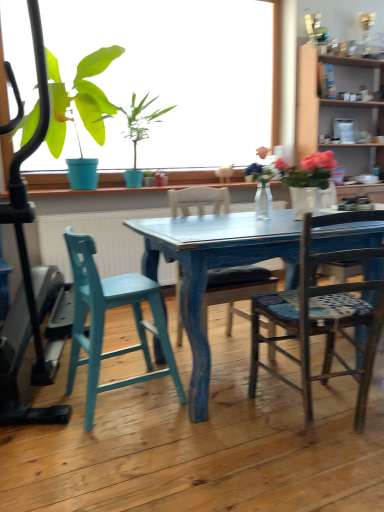
Measure the distance between point (347, 143) and camera.

A distance of 3.84 meters exists between point (347, 143) and camera.

This screenshot has width=384, height=512. Identify the location of matte white mug at upper center. (346, 131).

How much space does wooden chair with patterned seat cushion at center, which appears as the third chair when viewed from the left, occupy vertically?

35.22 inches.

What do you see at coordinates (323, 317) in the screenshot?
I see `wooden chair with patterned seat cushion at center, the 1th chair when ordered from right to left` at bounding box center [323, 317].

You are a GUI agent. You are given a task and a screenshot of the screen. Output one action in this format:
    pyautogui.click(x=<x>, y=<y>)
    Task: Click on the wooden chair at center, which appears as the second chair when viewed from the left
    The height and width of the screenshot is (512, 384).
    Given the screenshot: What is the action you would take?
    pyautogui.click(x=235, y=289)

In order to face wooden chair at center, which appears as the second chair when viewed from the left, should I rotate leftwards or rightwards?

It's best to rotate right around 3.713 degrees.

I want to click on green matte plant at upper left, so click(x=79, y=97).

From the image's perspective, is green matte plant at upper left beneath teal wood stool at left, which appears as the 3th chair when viewed from the right?

Incorrect, from the image's perspective, green matte plant at upper left is higher than teal wood stool at left, which appears as the 3th chair when viewed from the right.

Which is closer to the camera, [85,64] or [169,370]?

The point [169,370] is closer to the camera.

Considering the relative sizes of green matte plant at upper left and teal wood stool at left, which appears as the 3th chair when viewed from the right, in the image provided, is green matte plant at upper left thinner than teal wood stool at left, which appears as the 3th chair when viewed from the right,?

No.

Looking at this image, can you confirm if matte white mug at upper center is wider than wooden chair with patterned seat cushion at center, the 1th chair when ordered from right to left?

No, matte white mug at upper center is not wider than wooden chair with patterned seat cushion at center, the 1th chair when ordered from right to left.

How much distance is there between matte white mug at upper center and wooden chair with patterned seat cushion at center, the 1th chair when ordered from right to left?

matte white mug at upper center is 2.61 meters from wooden chair with patterned seat cushion at center, the 1th chair when ordered from right to left.

Is the depth of matte white mug at upper center greater than that of wooden chair with patterned seat cushion at center, the 1th chair when ordered from right to left?

Yes, matte white mug at upper center is further from the camera.

Is wooden chair with patterned seat cushion at center, which appears as the third chair when viewed from the left, at the back of matte white mug at upper center?

No.

Which of these two, teal wood stool at left, which appears as the 3th chair when viewed from the right, or green matte plant at upper left, is smaller?

teal wood stool at left, which appears as the 3th chair when viewed from the right, is smaller.

From the image's perspective, is teal wood stool at left, which ranks as the 1th chair in left-to-right order, below green matte plant at upper left?

Yes, from the image's perspective, teal wood stool at left, which ranks as the 1th chair in left-to-right order, is below green matte plant at upper left.

From a real-world perspective, which object rests below the other?

teal wood stool at left, which appears as the 3th chair when viewed from the right, is physically lower.

Is teal wood stool at left, which appears as the 3th chair when viewed from the right, facing towards green matte plant at upper left?

No, teal wood stool at left, which appears as the 3th chair when viewed from the right, is not oriented towards green matte plant at upper left.

From a real-world perspective, which object rests below the other?

wooden cabinet at upper right, from a real-world perspective.

How much distance is there between wooden cabinet at upper right and green matte plant at upper left?

They are 6.59 feet apart.

From the image's perspective, would you say wooden cabinet at upper right is positioned over green matte plant at upper left?

No, from the image's perspective, wooden cabinet at upper right is not above green matte plant at upper left.

Is wooden cabinet at upper right oriented away from green matte plant at upper left?

No, wooden cabinet at upper right is not facing away from green matte plant at upper left.

Who is taller, teal wood stool at left, which ranks as the 1th chair in left-to-right order, or wooden cabinet at upper right?

wooden cabinet at upper right is taller.

Is teal wood stool at left, which appears as the 3th chair when viewed from the right, not within wooden cabinet at upper right?

Yes, teal wood stool at left, which appears as the 3th chair when viewed from the right, is not within wooden cabinet at upper right.

In the image, is teal wood stool at left, which appears as the 3th chair when viewed from the right, positioned in front of or behind wooden cabinet at upper right?

teal wood stool at left, which appears as the 3th chair when viewed from the right, is positioned closer to the viewer than wooden cabinet at upper right.

Measure the distance between teal wood stool at left, which appears as the 3th chair when viewed from the right, and wooden chair at center, which appears as the second chair when viewed from the left.

teal wood stool at left, which appears as the 3th chair when viewed from the right, and wooden chair at center, which appears as the second chair when viewed from the left, are 16.84 inches apart from each other.

Considering the relative sizes of teal wood stool at left, which appears as the 3th chair when viewed from the right, and wooden chair at center, the second chair in the right-to-left sequence, in the image provided, is teal wood stool at left, which appears as the 3th chair when viewed from the right, bigger than wooden chair at center, the second chair in the right-to-left sequence,?

No.

Between teal wood stool at left, which appears as the 3th chair when viewed from the right, and wooden chair at center, which appears as the second chair when viewed from the left, which one appears on the left side from the viewer's perspective?

From the viewer's perspective, teal wood stool at left, which appears as the 3th chair when viewed from the right, appears more on the left side.

Does point (76, 273) lie behind point (179, 312)?

No, (76, 273) is closer to viewer.

Is wooden chair at center, which appears as the second chair when viewed from the left, far from wooden cabinet at upper right?

wooden chair at center, which appears as the second chair when viewed from the left, is positioned a significant distance from wooden cabinet at upper right.

Image resolution: width=384 pixels, height=512 pixels. Find the location of `the 2nd chair counting from the left of the wooden cabinet at upper right`. the 2nd chair counting from the left of the wooden cabinet at upper right is located at coordinates (235, 289).

Can you confirm if wooden chair at center, the second chair in the right-to-left sequence, is thinner than wooden cabinet at upper right?

Incorrect, the width of wooden chair at center, the second chair in the right-to-left sequence, is not less than that of wooden cabinet at upper right.

Can you confirm if wooden chair at center, the second chair in the right-to-left sequence, is positioned to the left of wooden cabinet at upper right?

Yes.

Where is `houseplant that is behind the teal wood stool at left, which ranks as the 1th chair in left-to-right order`? houseplant that is behind the teal wood stool at left, which ranks as the 1th chair in left-to-right order is located at coordinates (79, 97).

I want to click on coffee cup positioned vertically above the wooden chair with patterned seat cushion at center, which appears as the third chair when viewed from the left (from a real-world perspective), so click(346, 131).

Estimate the real-world distances between objects in this image. Which object is closer to wooden chair at center, which appears as the second chair when viewed from the left, wooden chair with patterned seat cushion at center, the 1th chair when ordered from right to left, or matte white mug at upper center?

wooden chair with patterned seat cushion at center, the 1th chair when ordered from right to left, is positioned closer to the anchor wooden chair at center, which appears as the second chair when viewed from the left.

Estimate the real-world distances between objects in this image. Which object is closer to green matte plant at upper left, wooden cabinet at upper right or wooden chair at center, which appears as the second chair when viewed from the left?

wooden chair at center, which appears as the second chair when viewed from the left.

Looking at the image, which one is located closer to wooden chair with patterned seat cushion at center, which appears as the third chair when viewed from the left, teal wood stool at left, which appears as the 3th chair when viewed from the right, or wooden cabinet at upper right?

The object closer to wooden chair with patterned seat cushion at center, which appears as the third chair when viewed from the left, is teal wood stool at left, which appears as the 3th chair when viewed from the right.

When comparing their distances from teal wood stool at left, which ranks as the 1th chair in left-to-right order, does wooden chair at center, the second chair in the right-to-left sequence, or green matte plant at upper left seem closer?

wooden chair at center, the second chair in the right-to-left sequence, lies closer to teal wood stool at left, which ranks as the 1th chair in left-to-right order, than the other object.

Looking at the image, which one is located closer to matte white mug at upper center, wooden chair at center, the second chair in the right-to-left sequence, or wooden cabinet at upper right?

wooden cabinet at upper right.

Looking at the image, which one is located further to wooden chair at center, the second chair in the right-to-left sequence, wooden cabinet at upper right or green matte plant at upper left?

The object further to wooden chair at center, the second chair in the right-to-left sequence, is wooden cabinet at upper right.

Estimate the real-world distances between objects in this image. Which object is closer to wooden cabinet at upper right, wooden chair at center, which appears as the second chair when viewed from the left, or teal wood stool at left, which appears as the 3th chair when viewed from the right?

Based on the image, wooden chair at center, which appears as the second chair when viewed from the left, appears to be nearer to wooden cabinet at upper right.

When comparing their distances from green matte plant at upper left, does wooden cabinet at upper right or teal wood stool at left, which appears as the 3th chair when viewed from the right, seem closer?

teal wood stool at left, which appears as the 3th chair when viewed from the right, is positioned closer to the anchor green matte plant at upper left.

The width and height of the screenshot is (384, 512). Identify the location of cabinetry positioned between wooden chair with patterned seat cushion at center, the 1th chair when ordered from right to left, and matte white mug at upper center from near to far. (338, 109).

Find the location of a particular element. This screenshot has height=512, width=384. cabinetry between teal wood stool at left, which ranks as the 1th chair in left-to-right order, and matte white mug at upper center from front to back is located at coordinates (338, 109).

Locate an element on the screen. houseplant between wooden chair with patterned seat cushion at center, the 1th chair when ordered from right to left, and matte white mug at upper center in the front-back direction is located at coordinates pyautogui.click(x=79, y=97).

At what (x,y) coordinates should I click in order to perform the action: click on chair situated between teal wood stool at left, which ranks as the 1th chair in left-to-right order, and wooden chair with patterned seat cushion at center, which appears as the third chair when viewed from the left, from left to right. Please return your answer as a coordinate pair (x, y). This screenshot has width=384, height=512. Looking at the image, I should click on (235, 289).